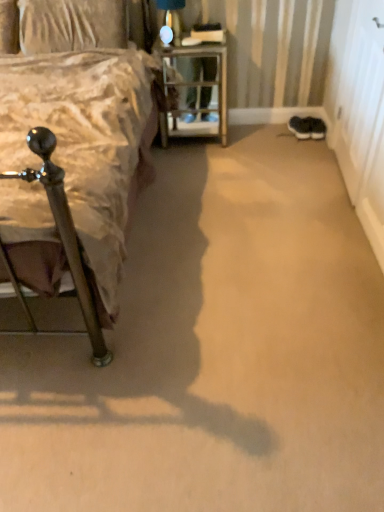
Where is `empty space that is ontop of black suede sneakers at lower right, marked as the first footwear in a right-to-left arrangement (from a real-world perspective)`? empty space that is ontop of black suede sneakers at lower right, marked as the first footwear in a right-to-left arrangement (from a real-world perspective) is located at coordinates (324, 111).